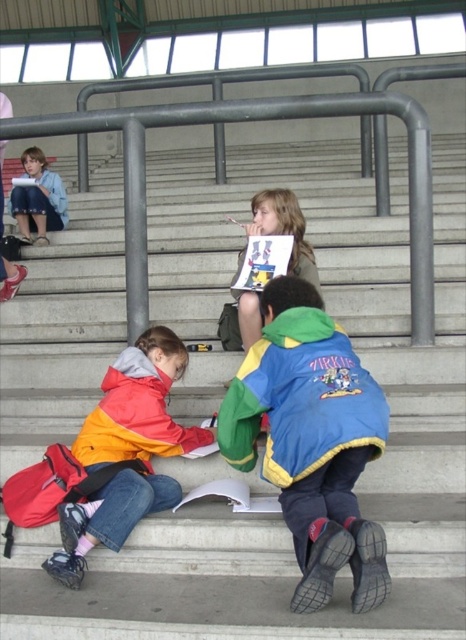
Question: Is blue fleece jacket at center positioned at the back of orange fleece jacket at lower left?

Choices:
 (A) no
 (B) yes

Answer: (A)

Question: Is matte yellow jacket at center further to the viewer compared to denim jacket at upper left?

Choices:
 (A) no
 (B) yes

Answer: (A)

Question: Considering the real-world distances, which object is farthest from the blue fleece jacket at center?

Choices:
 (A) orange/yellow jacket at lower left
 (B) denim jacket at upper left
 (C) orange fleece jacket at lower left
 (D) matte yellow jacket at center

Answer: (B)

Question: Which object appears farthest from the camera in this image?

Choices:
 (A) orange/yellow jacket at lower left
 (B) blue fleece jacket at center

Answer: (A)

Question: Which point is farther from the camera taking this photo?

Choices:
 (A) (276, 230)
 (B) (159, 449)
 (C) (271, 349)
 (D) (117, 419)

Answer: (A)

Question: Can you confirm if orange fleece jacket at lower left is smaller than denim jacket at upper left?

Choices:
 (A) yes
 (B) no

Answer: (A)